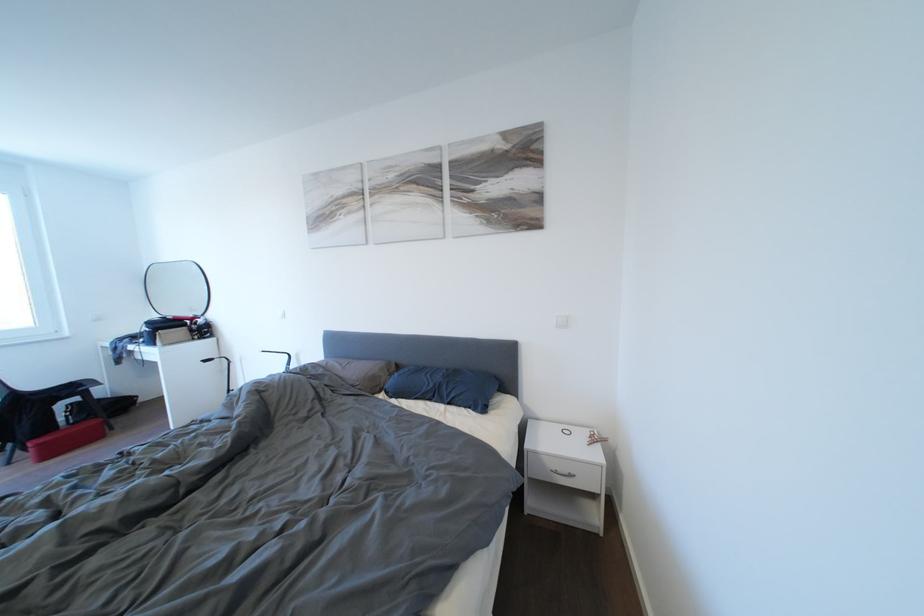
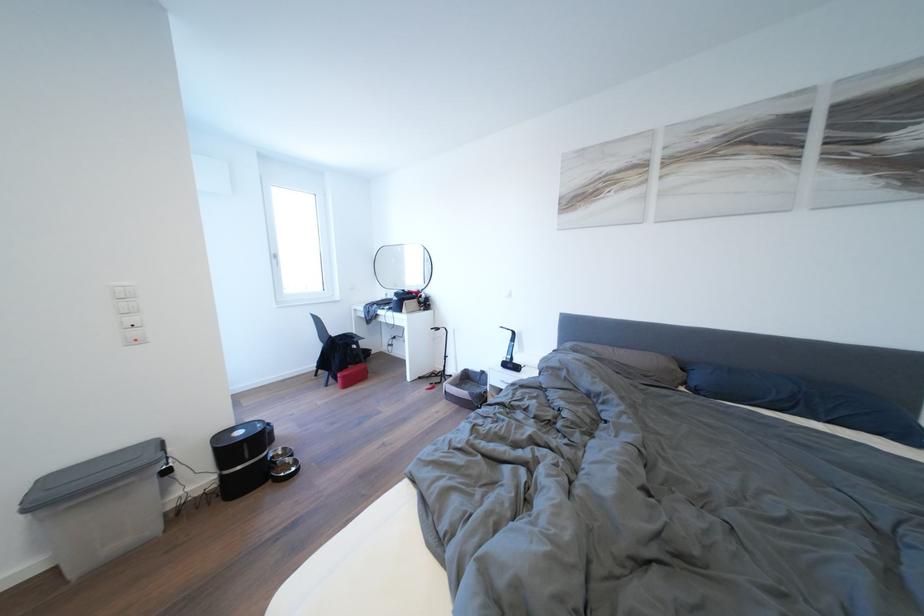
Question: Which direction would the cameraman need to move to produce the second image? Reply with the corresponding letter.

Choices:
 (A) Left
 (B) Right
 (C) Forward
 (D) Backward

Answer: (A)